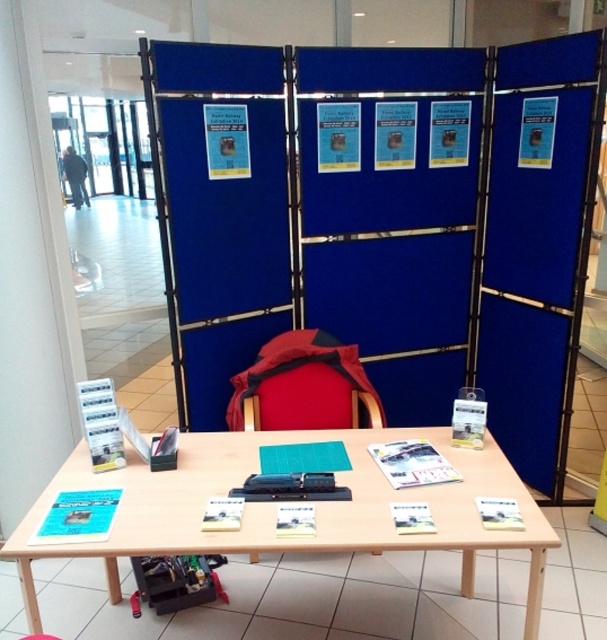
Question: Which object appears closest to the camera in this image?

Choices:
 (A) velvet-like red chair at center
 (B) wooden table at center
 (C) blue fabric at center

Answer: (B)

Question: Does wooden table at center come behind velvet-like red chair at center?

Choices:
 (A) yes
 (B) no

Answer: (B)

Question: Which point is closer to the camera?

Choices:
 (A) wooden table at center
 (B) red fabric chair at center
 (C) pink plastic stool at lower center

Answer: (A)

Question: Can you confirm if blue fabric at center is positioned to the left of pink plastic stool at lower center?

Choices:
 (A) yes
 (B) no

Answer: (B)

Question: Is red fabric chair at center wider than pink plastic stool at lower center?

Choices:
 (A) yes
 (B) no

Answer: (A)

Question: Which object is the farthest from the pink plastic stool at lower center?

Choices:
 (A) red fabric chair at center
 (B) wooden table at center
 (C) blue fabric at center

Answer: (C)